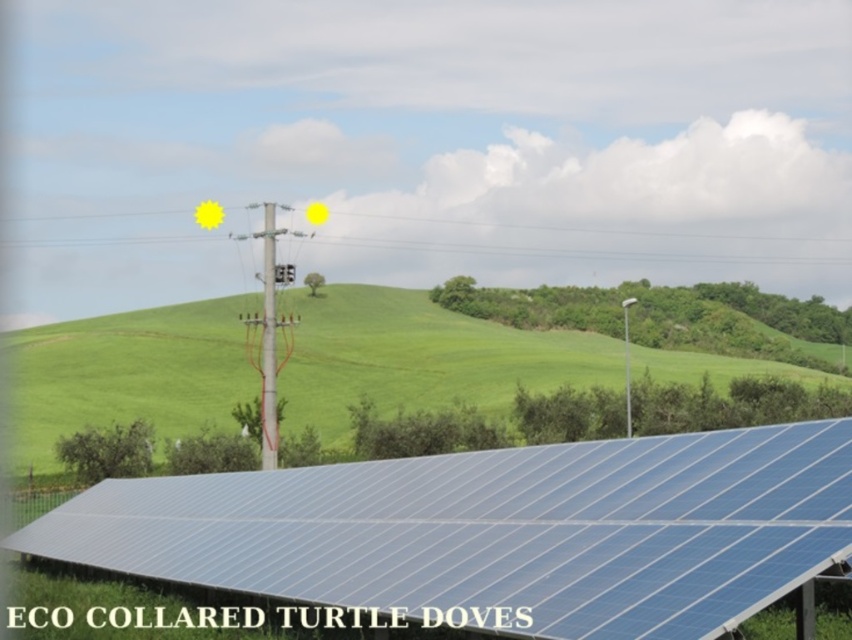
Who is taller, blue solar panel at lower center or green grassy hillside at center?

green grassy hillside at center

Does blue solar panel at lower center have a lesser width compared to green grassy hillside at center?

Yes, blue solar panel at lower center is thinner than green grassy hillside at center.

Describe the element at coordinates (498, 529) in the screenshot. The height and width of the screenshot is (640, 852). I see `blue solar panel at lower center` at that location.

At what (x,y) coordinates should I click in order to perform the action: click on blue solar panel at lower center. Please return your answer as a coordinate pair (x, y). The height and width of the screenshot is (640, 852). Looking at the image, I should click on (498, 529).